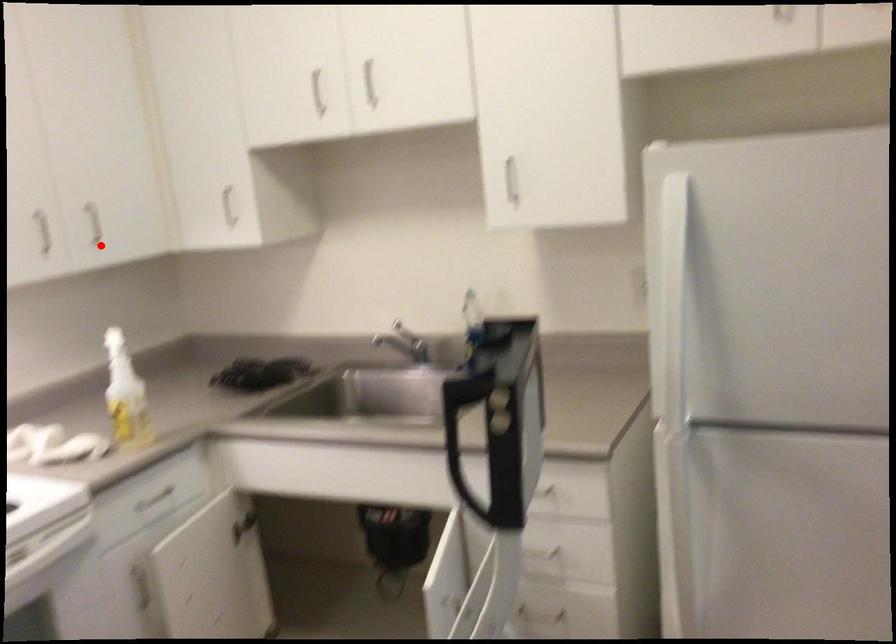
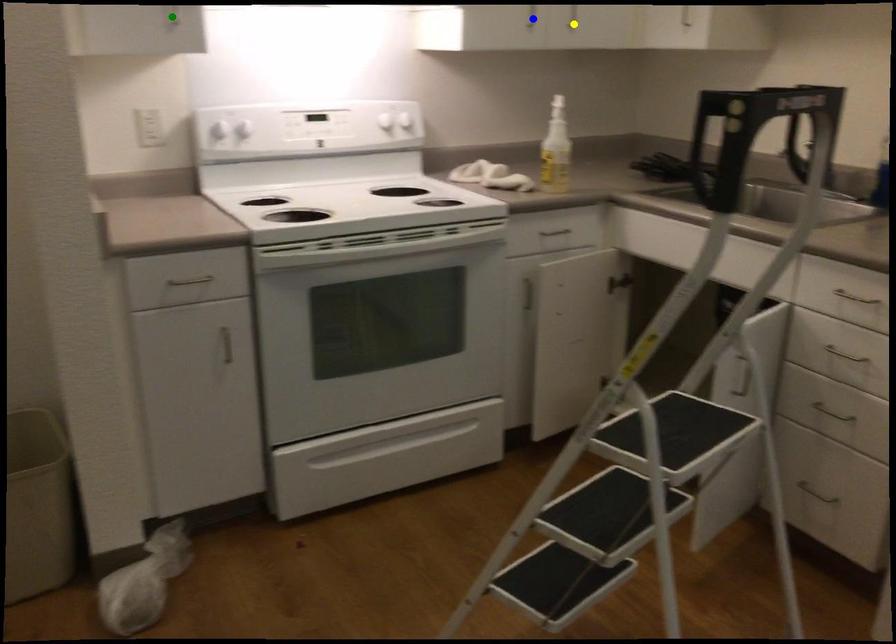
Question: I am providing you with two images of the same scene from different viewpoints. A red point is marked on the first image. You are given multiple points on the second image. Which point in image 2 is actually the same real-world point as the red point in image 1?

Choices:
 (A) green point
 (B) blue point
 (C) yellow point

Answer: (C)